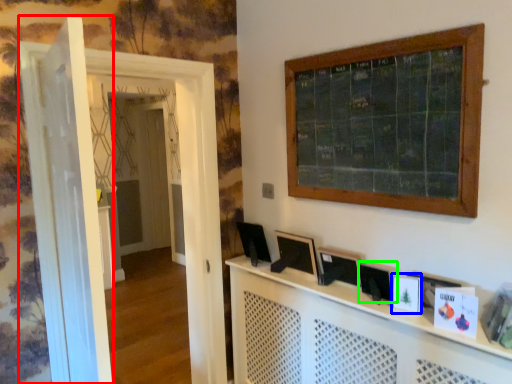
Question: Based on their relative distances, which object is farther from door (highlighted by a red box)? Choose from picture frame (highlighted by a blue box) and picture frame (highlighted by a green box).

Choices:
 (A) picture frame
 (B) picture frame

Answer: (A)